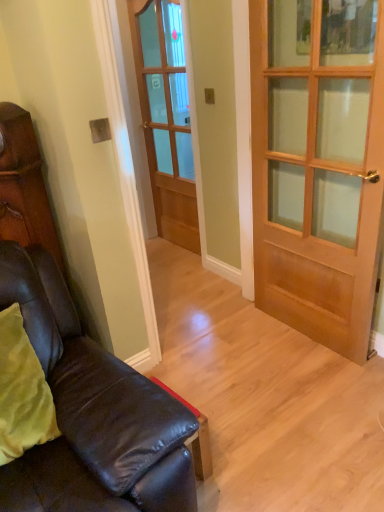
The image size is (384, 512). I want to click on vacant space situated above leather couch at lower left (from a real-world perspective), so click(x=238, y=355).